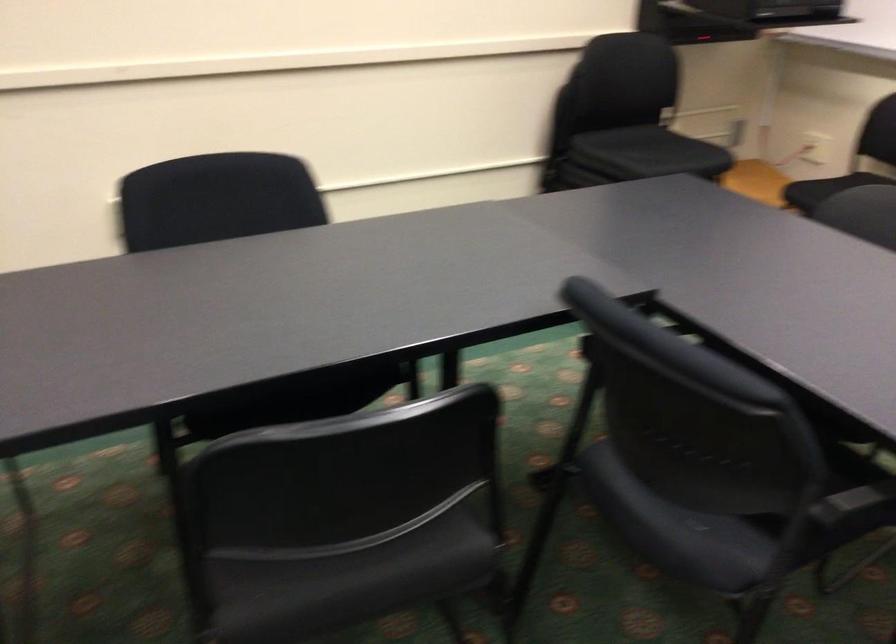
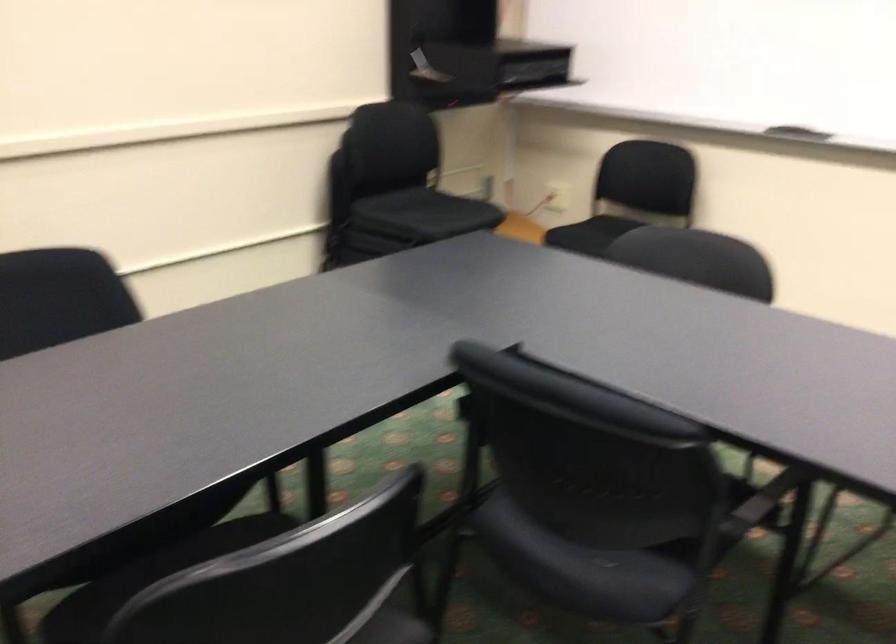
Question: The images are taken continuously from a first-person perspective. In which direction is your viewpoint rotating?

Choices:
 (A) Left
 (B) Right
 (C) Up
 (D) Down

Answer: (B)